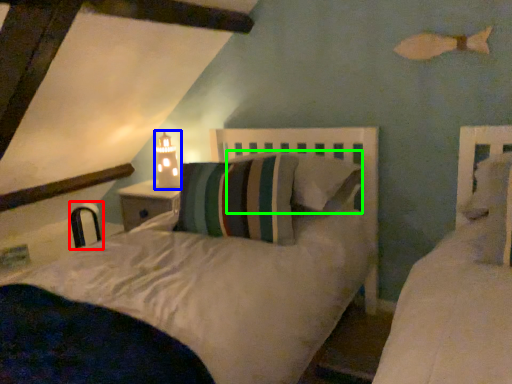
Question: Which object is positioned closest to chair (highlighted by a red box)? Select from table lamp (highlighted by a blue box) and pillow (highlighted by a green box).

Choices:
 (A) table lamp
 (B) pillow

Answer: (A)